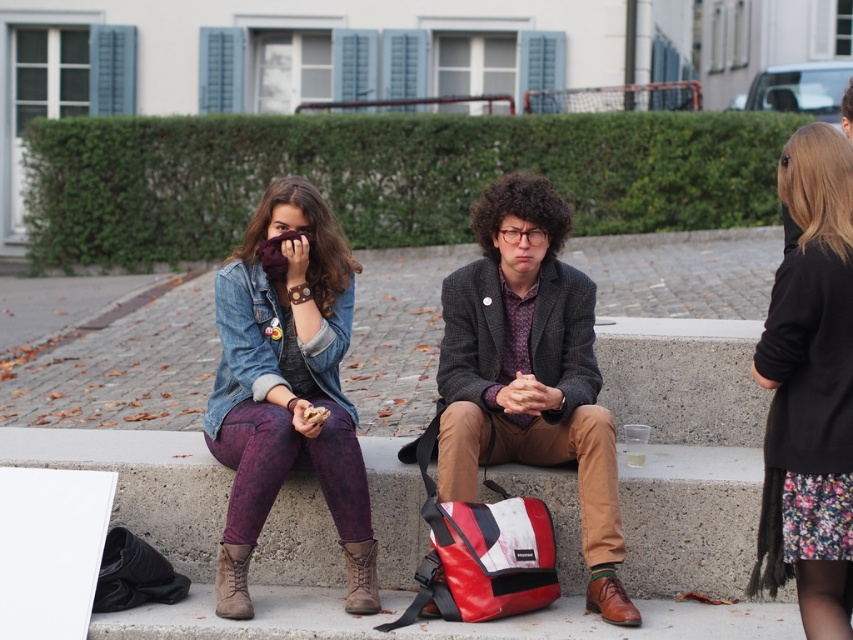
Consider the image. Does textured wool blazer at center appear on the left side of brown leather boot at lower left?

Incorrect, textured wool blazer at center is not on the left side of brown leather boot at lower left.

Is textured wool blazer at center positioned in front of brown leather boot at lower left?

No, textured wool blazer at center is further to the viewer.

What do you see at coordinates (529, 371) in the screenshot? I see `textured wool blazer at center` at bounding box center [529, 371].

You are a GUI agent. You are given a task and a screenshot of the screen. Output one action in this format:
    pyautogui.click(x=<x>, y=<y>)
    Task: Click on the textured wool blazer at center
    
    Given the screenshot: What is the action you would take?
    pyautogui.click(x=529, y=371)

Does floral dress at right have a lesser width compared to brown leather boot at lower left?

No.

Between point (782, 186) and point (235, 557), which one is positioned behind?

The point (235, 557) is more distant.

The height and width of the screenshot is (640, 853). I want to click on floral dress at right, so click(810, 388).

Who is lower down, denim jacket at left or floral dress at right?

Positioned lower is floral dress at right.

Who is more forward, [274,280] or [850,216]?

Point [850,216] is in front.

Is point (352, 298) more distant than point (825, 573)?

Yes, point (352, 298) is behind point (825, 573).

Identify the location of denim jacket at left. The height and width of the screenshot is (640, 853). (286, 364).